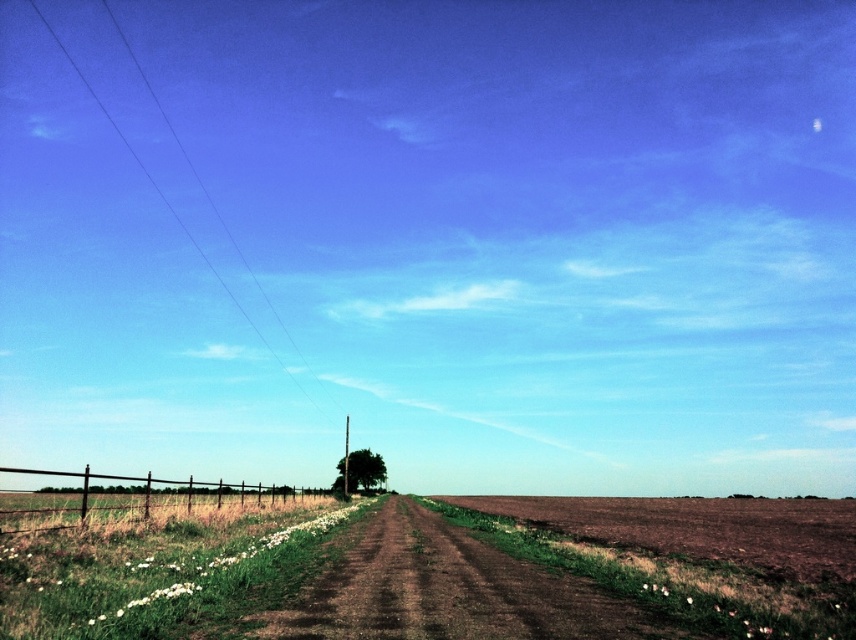
Question: Which object is the closest to the clear blue wires at upper left?

Choices:
 (A) brown soil at center
 (B) green leafy tree at center
 (C) brown dirt track at center

Answer: (B)

Question: Does brown dirt track at center appear under brown soil at center?

Choices:
 (A) no
 (B) yes

Answer: (A)

Question: Can you confirm if brown dirt track at center is smaller than green leafy tree at center?

Choices:
 (A) no
 (B) yes

Answer: (A)

Question: Does brown wooden fence at left appear on the right side of clear blue wires at upper left?

Choices:
 (A) yes
 (B) no

Answer: (A)

Question: Which object is positioned farthest from the clear blue wires at upper left?

Choices:
 (A) brown wooden fence at left
 (B) brown dirt track at center
 (C) green leafy tree at center
 (D) brown soil at center

Answer: (B)

Question: Which of the following is the farthest from the observer?

Choices:
 (A) (423, 547)
 (B) (163, 198)
 (C) (348, 465)

Answer: (B)